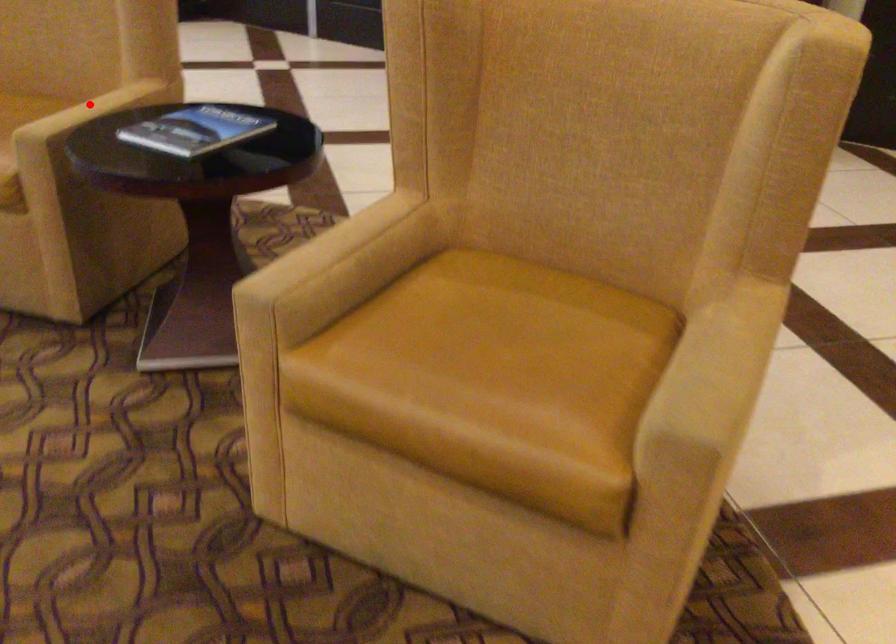
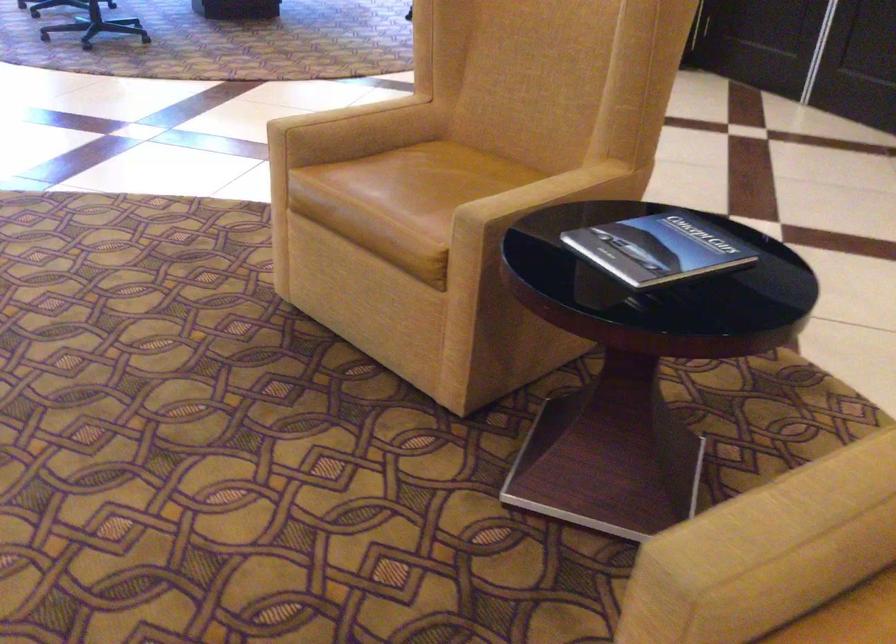
Question: I am providing you with two images of the same scene from different viewpoints. Given a red point in image1, look at the same physical point in image2. Is it:

Choices:
 (A) Closer to the viewpoint
 (B) Farther from the viewpoint

Answer: (A)